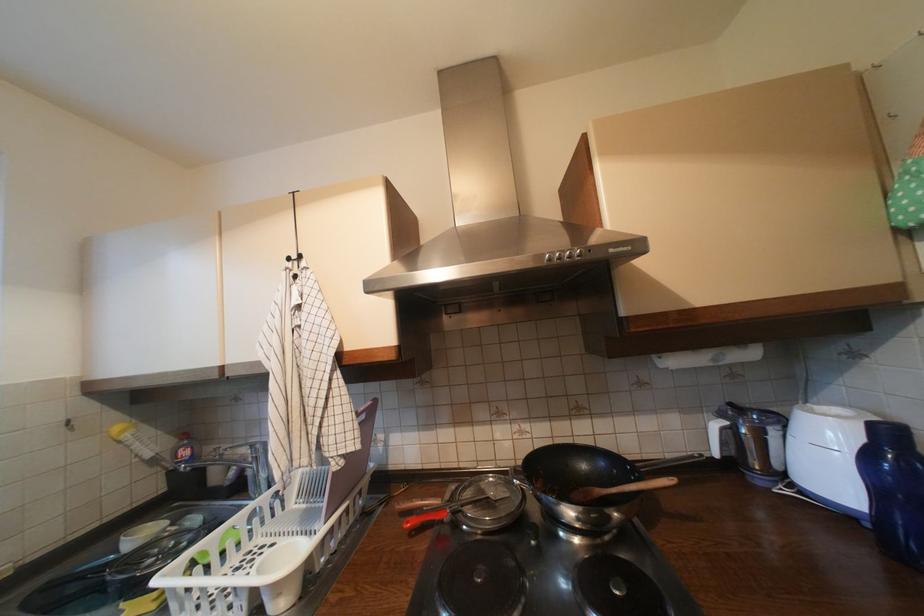
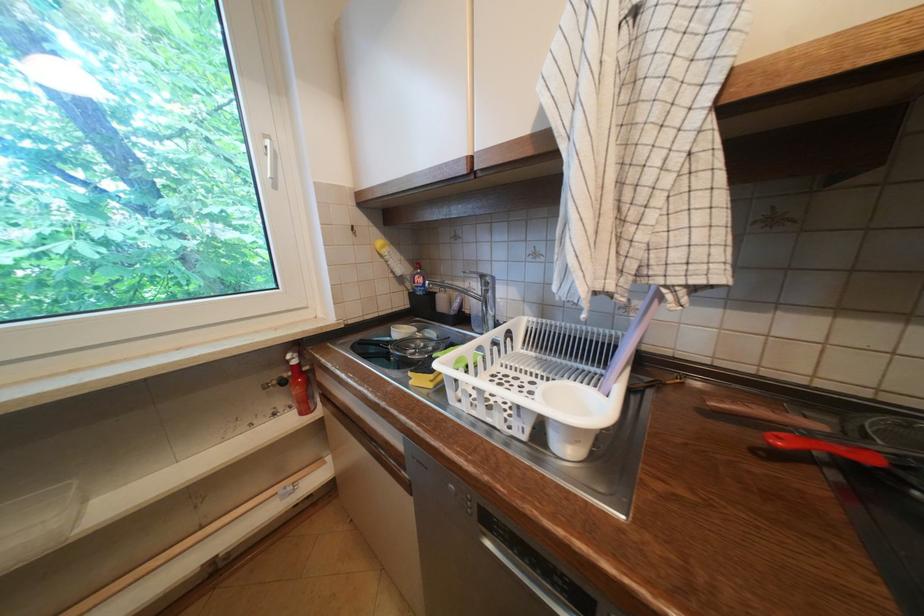
Where in the second image is the point corresponding to [417,524] from the first image?

(788, 440)